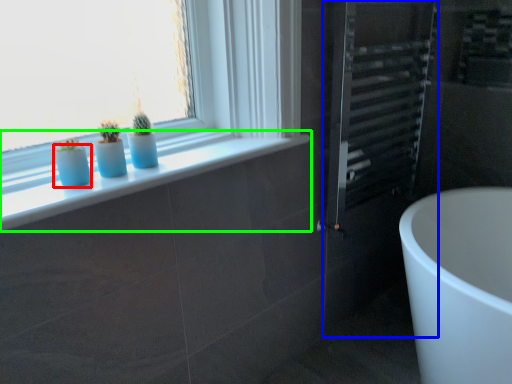
Question: Which object is the farthest from glass vase (highlighted by a red box)? Choose among these: screen door (highlighted by a blue box) or window sill (highlighted by a green box).

Choices:
 (A) screen door
 (B) window sill

Answer: (A)